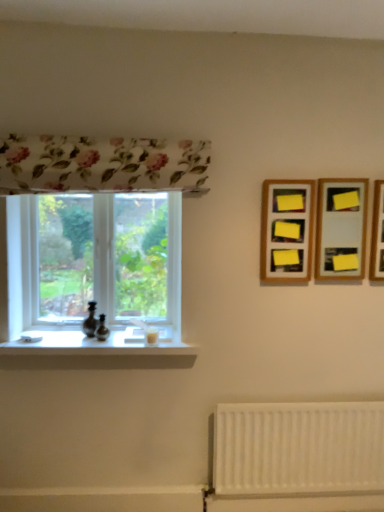
Image resolution: width=384 pixels, height=512 pixels. Describe the element at coordinates (287, 230) in the screenshot. I see `wooden frame at upper right, acting as the third picture frame starting from the right` at that location.

Where is `white matte radiator at lower right`? Image resolution: width=384 pixels, height=512 pixels. white matte radiator at lower right is located at coordinates pos(298,448).

What do you see at coordinates (103, 255) in the screenshot? I see `clear glass window at left` at bounding box center [103, 255].

At what (x,y) coordinates should I click in order to perform the action: click on yellow paper at upper right, the second picture frame viewed from the left. Please return your answer as a coordinate pair (x, y). This screenshot has height=512, width=384. Looking at the image, I should click on (341, 229).

Does wooden frame at upper right, marked as the 1th picture frame in a left-to-right arrangement, have a greater height compared to white matte radiator at lower right?

Incorrect, the height of wooden frame at upper right, marked as the 1th picture frame in a left-to-right arrangement, is not larger of that of white matte radiator at lower right.

Considering their positions, is wooden frame at upper right, marked as the 1th picture frame in a left-to-right arrangement, located in front of or behind white matte radiator at lower right?

wooden frame at upper right, marked as the 1th picture frame in a left-to-right arrangement, is positioned closer to the viewer than white matte radiator at lower right.

Are wooden frame at upper right, marked as the 1th picture frame in a left-to-right arrangement, and white matte radiator at lower right beside each other?

No, wooden frame at upper right, marked as the 1th picture frame in a left-to-right arrangement, is not with white matte radiator at lower right.

From the image's perspective, would you say wooden frame at upper right, acting as the third picture frame starting from the right, is shown under white matte radiator at lower right?

No.

Looking at this image, from the image's perspective, is clear glass window at left located beneath wooden frame at upper right, marked as the 1th picture frame in a left-to-right arrangement?

Yes, from the image's perspective, clear glass window at left is below wooden frame at upper right, marked as the 1th picture frame in a left-to-right arrangement.

Is clear glass window at left spatially inside wooden frame at upper right, marked as the 1th picture frame in a left-to-right arrangement, or outside of it?

clear glass window at left is outside wooden frame at upper right, marked as the 1th picture frame in a left-to-right arrangement.

Does clear glass window at left have a lesser width compared to wooden frame at upper right, marked as the 1th picture frame in a left-to-right arrangement?

Incorrect, the width of clear glass window at left is not less than that of wooden frame at upper right, marked as the 1th picture frame in a left-to-right arrangement.

Looking at this image, from a real-world perspective, is clear glass window at left physically below wooden frame at upper right, marked as the 1th picture frame in a left-to-right arrangement?

Yes, from a real-world perspective, clear glass window at left is under wooden frame at upper right, marked as the 1th picture frame in a left-to-right arrangement.

In the scene shown: Is wooden frame at upper right, acting as the third picture frame starting from the right, turned away from yellow paper at upper right, the second picture frame viewed from the left?

No, wooden frame at upper right, acting as the third picture frame starting from the right, is not facing the opposite direction of yellow paper at upper right, the second picture frame viewed from the left.

Which is more to the left, wooden frame at upper right, marked as the 1th picture frame in a left-to-right arrangement, or yellow paper at upper right, the second picture frame viewed from the left?

wooden frame at upper right, marked as the 1th picture frame in a left-to-right arrangement, is more to the left.

Can you confirm if wooden frame at upper right, acting as the third picture frame starting from the right, is smaller than yellow paper at upper right, the second picture frame viewed from the left?

No, wooden frame at upper right, acting as the third picture frame starting from the right, is not smaller than yellow paper at upper right, the second picture frame viewed from the left.

Consider the image. Is yellow paper at upper right, which is the 2th picture frame from right to left, in front of clear glass window at left?

Yes, yellow paper at upper right, which is the 2th picture frame from right to left, is closer to the viewer.

From the image's perspective, is yellow paper at upper right, which is the 2th picture frame from right to left, positioned above or below clear glass window at left?

Clearly, from the image's perspective, yellow paper at upper right, which is the 2th picture frame from right to left, is above clear glass window at left.

Is yellow paper at upper right, the second picture frame viewed from the left, next to clear glass window at left and touching it?

yellow paper at upper right, the second picture frame viewed from the left, and clear glass window at left are not in contact.

From a real-world perspective, which is physically above, yellow paper at upper right, which is the 2th picture frame from right to left, or clear glass window at left?

yellow paper at upper right, which is the 2th picture frame from right to left, is physically above.

Is clear glass window at left beside wooden picture frame at upper right, which is the 3th picture frame in left-to-right order?

clear glass window at left is not next to wooden picture frame at upper right, which is the 3th picture frame in left-to-right order, and they're not touching.

From a real-world perspective, is clear glass window at left located higher than wooden picture frame at upper right, which is the 3th picture frame in left-to-right order?

Incorrect, from a real-world perspective, clear glass window at left is lower than wooden picture frame at upper right, which is the 3th picture frame in left-to-right order.

Is wooden picture frame at upper right, which is the 3th picture frame in left-to-right order, at the back of clear glass window at left?

That's not correct — clear glass window at left is not looking away from wooden picture frame at upper right, which is the 3th picture frame in left-to-right order.

Would you say clear glass window at left is outside wooden picture frame at upper right, marked as the 1th picture frame in a right-to-left arrangement?

Absolutely, clear glass window at left is external to wooden picture frame at upper right, marked as the 1th picture frame in a right-to-left arrangement.

How different are the orientations of wooden frame at upper right, marked as the 1th picture frame in a left-to-right arrangement, and white glossy window sill at lower left in degrees?

0.125 degrees.

In terms of height, does wooden frame at upper right, acting as the third picture frame starting from the right, look taller or shorter compared to white glossy window sill at lower left?

wooden frame at upper right, acting as the third picture frame starting from the right, is taller than white glossy window sill at lower left.

From a real-world perspective, which is physically above, wooden frame at upper right, marked as the 1th picture frame in a left-to-right arrangement, or white glossy window sill at lower left?

From a 3D spatial view, wooden frame at upper right, marked as the 1th picture frame in a left-to-right arrangement, is above.

What's the angular difference between white matte radiator at lower right and wooden picture frame at upper right, marked as the 1th picture frame in a right-to-left arrangement,'s facing directions?

The angular difference between white matte radiator at lower right and wooden picture frame at upper right, marked as the 1th picture frame in a right-to-left arrangement, is 0.573 degrees.

From the image's perspective, is white matte radiator at lower right above or below wooden picture frame at upper right, marked as the 1th picture frame in a right-to-left arrangement?

From the image's perspective, white matte radiator at lower right appears below wooden picture frame at upper right, marked as the 1th picture frame in a right-to-left arrangement.

Considering the points (222, 440) and (381, 181), which point is behind, point (222, 440) or point (381, 181)?

Positioned behind is point (222, 440).

From a real-world perspective, starting from the white matte radiator at lower right, which picture frame is the 1st one vertically above it? Please provide its 2D coordinates.

[(287, 230)]

Locate an element on the screen. This screenshot has width=384, height=512. the 1st picture frame to the right of the clear glass window at left, starting your count from the anchor is located at coordinates (287, 230).

Which object lies further to the anchor point wooden picture frame at upper right, marked as the 1th picture frame in a right-to-left arrangement, yellow paper at upper right, the second picture frame viewed from the left, or wooden frame at upper right, marked as the 1th picture frame in a left-to-right arrangement?

wooden frame at upper right, marked as the 1th picture frame in a left-to-right arrangement, is positioned further to the anchor wooden picture frame at upper right, marked as the 1th picture frame in a right-to-left arrangement.

Considering their positions, is wooden frame at upper right, marked as the 1th picture frame in a left-to-right arrangement, positioned further to white matte radiator at lower right than white glossy window sill at lower left?

wooden frame at upper right, marked as the 1th picture frame in a left-to-right arrangement, is positioned further to the anchor white matte radiator at lower right.

Looking at the image, which one is located closer to white glossy window sill at lower left, white matte radiator at lower right or yellow paper at upper right, the second picture frame viewed from the left?

white matte radiator at lower right lies closer to white glossy window sill at lower left than the other object.

Based on their spatial positions, is clear glass window at left or wooden picture frame at upper right, which is the 3th picture frame in left-to-right order, closer to white glossy window sill at lower left?

Among the two, clear glass window at left is located nearer to white glossy window sill at lower left.

Looking at the image, which one is located closer to wooden frame at upper right, marked as the 1th picture frame in a left-to-right arrangement, wooden picture frame at upper right, which is the 3th picture frame in left-to-right order, or white glossy window sill at lower left?

wooden picture frame at upper right, which is the 3th picture frame in left-to-right order.

Looking at the image, which one is located closer to wooden picture frame at upper right, marked as the 1th picture frame in a right-to-left arrangement, white matte radiator at lower right or wooden frame at upper right, marked as the 1th picture frame in a left-to-right arrangement?

Based on the image, wooden frame at upper right, marked as the 1th picture frame in a left-to-right arrangement, appears to be nearer to wooden picture frame at upper right, marked as the 1th picture frame in a right-to-left arrangement.

Which object lies nearer to the anchor point yellow paper at upper right, which is the 2th picture frame from right to left, wooden picture frame at upper right, marked as the 1th picture frame in a right-to-left arrangement, or white matte radiator at lower right?

wooden picture frame at upper right, marked as the 1th picture frame in a right-to-left arrangement.

Considering their positions, is white matte radiator at lower right positioned further to clear glass window at left than wooden picture frame at upper right, which is the 3th picture frame in left-to-right order?

Among the two, wooden picture frame at upper right, which is the 3th picture frame in left-to-right order, is located further to clear glass window at left.

Find the location of a particular element. picture frame between wooden frame at upper right, marked as the 1th picture frame in a left-to-right arrangement, and wooden picture frame at upper right, which is the 3th picture frame in left-to-right order, from left to right is located at coordinates (341, 229).

The width and height of the screenshot is (384, 512). Identify the location of picture frame located between white glossy window sill at lower left and yellow paper at upper right, the second picture frame viewed from the left, in the left-right direction. (287, 230).

Find the location of a particular element. radiator between white glossy window sill at lower left and wooden picture frame at upper right, marked as the 1th picture frame in a right-to-left arrangement, in the horizontal direction is located at coordinates (298, 448).

The width and height of the screenshot is (384, 512). I want to click on radiator located between clear glass window at left and wooden picture frame at upper right, which is the 3th picture frame in left-to-right order, in the left-right direction, so click(x=298, y=448).